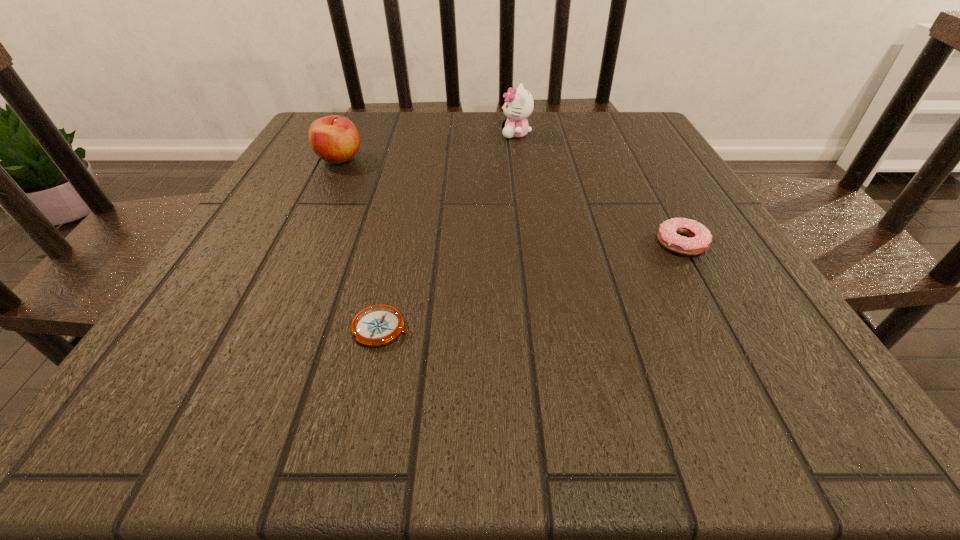
Where is `kitten`? kitten is located at coordinates pos(519,103).

Where is `the farthest object`? the farthest object is located at coordinates (519, 103).

Locate an element on the screen. apple is located at coordinates (335, 139).

Find the location of `the third shortest object`. the third shortest object is located at coordinates (335, 139).

Identify the location of the rightmost object. This screenshot has height=540, width=960. 700,238.

I want to click on the third tallest object, so click(x=700, y=238).

This screenshot has width=960, height=540. I want to click on the shortest object, so [x=377, y=325].

At what (x,y) coordinates should I click in order to perform the action: click on the third object from right to left. Please return your answer as a coordinate pair (x, y). Image resolution: width=960 pixels, height=540 pixels. Looking at the image, I should click on (377, 325).

I want to click on vacant space located on the front-facing side of the kitten, so click(x=371, y=134).

Locate an element on the screen. vacant area situated 0.310m on the front-facing side of the kitten is located at coordinates (375, 134).